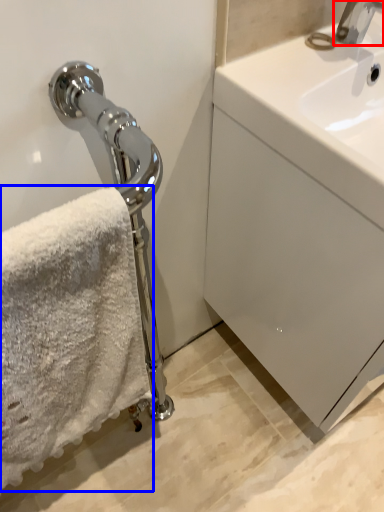
Question: Which point is closer to the camera, tap (highlighted by a red box) or towel (highlighted by a blue box)?

Choices:
 (A) tap
 (B) towel

Answer: (B)